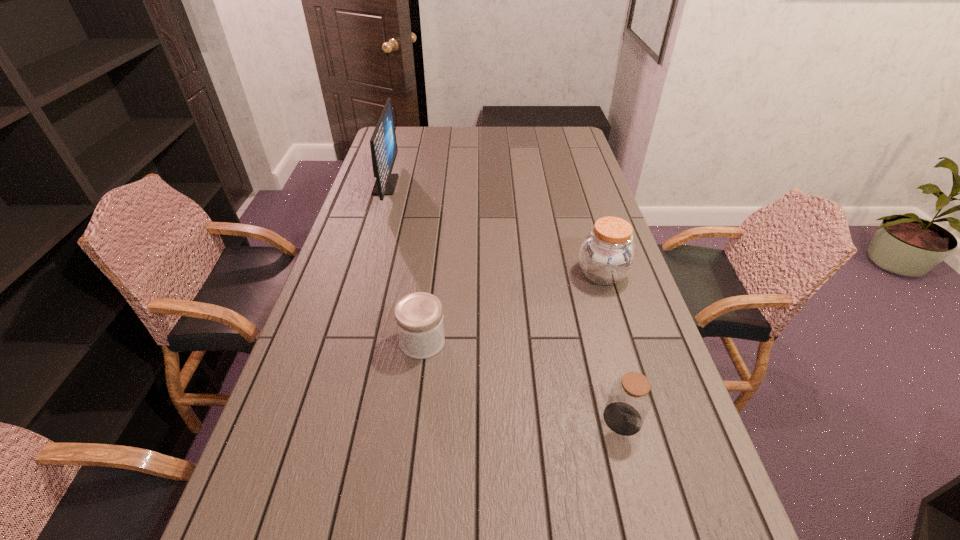
This screenshot has width=960, height=540. I want to click on computer monitor, so click(383, 144).

Where is `the tallest object`? the tallest object is located at coordinates (383, 144).

This screenshot has width=960, height=540. Identify the location of the farthest jar. (607, 254).

The width and height of the screenshot is (960, 540). What are the coordinates of `the tallest jar` in the screenshot? It's located at (x=607, y=254).

In order to click on the nearest jar in this screenshot , I will do `click(630, 398)`.

Locate an element on the screen. the second farthest jar is located at coordinates (419, 319).

Where is `the second object from left to right`? This screenshot has height=540, width=960. the second object from left to right is located at coordinates (419, 319).

Identify the location of free space located 0.360m on the screen side of the tallest object. (488, 185).

Locate an element on the screen. This screenshot has width=960, height=540. vacant area situated 0.300m on the left of the third shortest object is located at coordinates [476, 274].

Locate an element on the screen. Image resolution: width=960 pixels, height=540 pixels. vacant region located 0.050m on the back of the nearest jar is located at coordinates (613, 383).